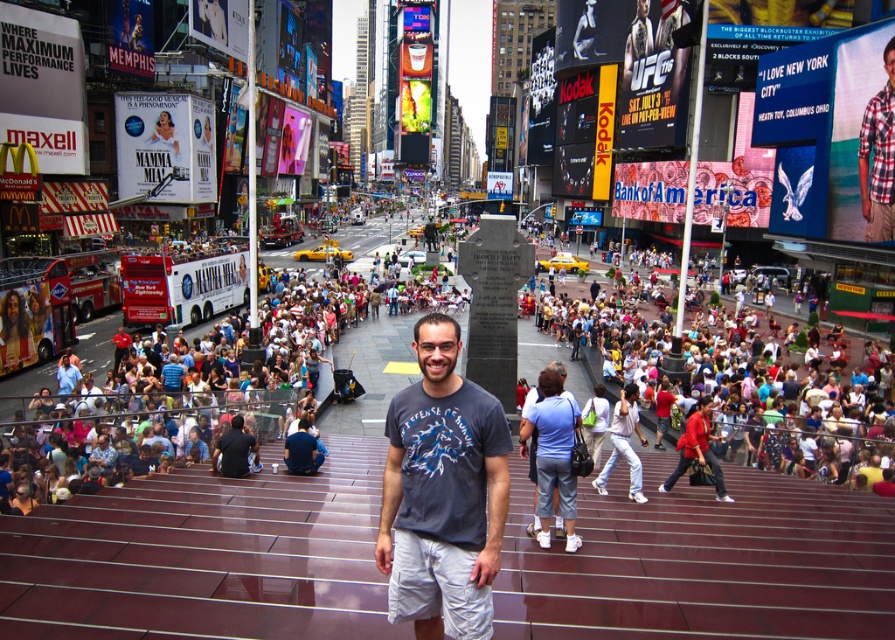
You are a photographer trying to capture a candid shot of the light blue denim shorts at center and the white cotton pants at center in the busy Times Square scene. Based on their positions, which one is closer to the camera?

The light blue denim shorts at center is below the white cotton pants at center, so the white cotton pants at center is closer to the camera.

You are standing at the point labeled point (x=893, y=115) in Times Square. You want to move to the point labeled point (x=415, y=582). Is the path between these two points clear of any obstacles?

Yes, the path between point (x=893, y=115) and point (x=415, y=582) is clear because point (x=415, y=582) is in front of point (x=893, y=115), indicating no obstruction between them.

You are a photographer standing in Times Square. You want to take a photo of the man on the red steps and the plaid cotton shirt at upper right in the same frame. The camera you have can only focus on objects within 60 meters of each other. Will you be able to capture both in focus?

The man on the red steps and the plaid cotton shirt at upper right are 62.63 meters apart, which exceeds the camera focus range of 60 meters. Therefore, you won not be able to capture both in focus.